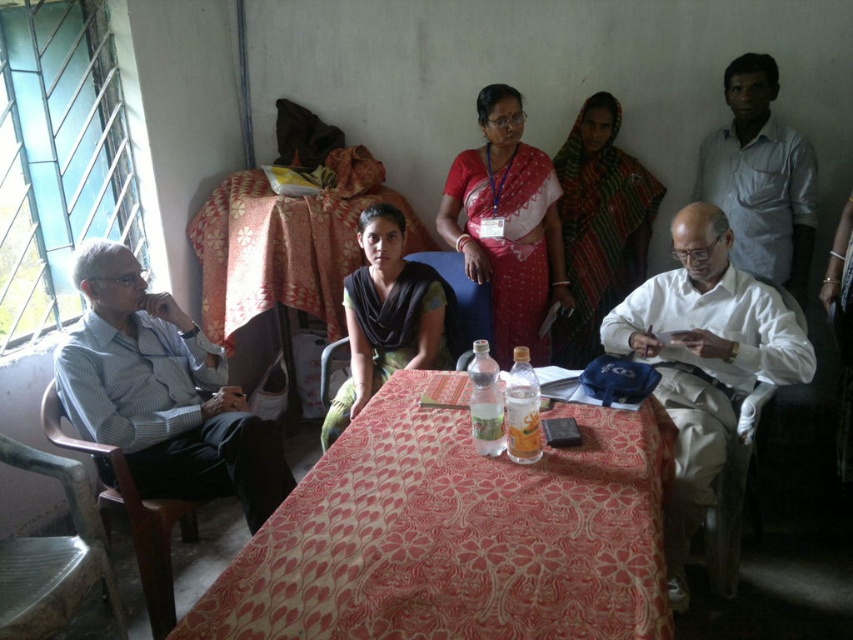
What do you see at coordinates (704, 360) in the screenshot? The height and width of the screenshot is (640, 853). I see `white cotton shirt at right` at bounding box center [704, 360].

Can you confirm if white cotton shirt at right is positioned to the right of white cotton shirt at upper right?

Incorrect, white cotton shirt at right is not on the right side of white cotton shirt at upper right.

Measure the distance between point (683, 337) and camera.

Point (683, 337) and camera are 2.13 meters apart.

Identify the location of white cotton shirt at right. Image resolution: width=853 pixels, height=640 pixels. (704, 360).

Is point (367, 566) behind point (595, 323)?

No, (367, 566) is in front of (595, 323).

Which is behind, point (459, 412) or point (589, 269)?

The point (589, 269) is behind.

This screenshot has height=640, width=853. What are the coordinates of `patterned fabric table at center` in the screenshot? It's located at (456, 532).

Does patterned fabric table at center come in front of floral fabric tablecloth at center?

Yes, patterned fabric table at center is in front of floral fabric tablecloth at center.

Which is below, patterned fabric table at center or floral fabric tablecloth at center?

Positioned lower is patterned fabric table at center.

What do you see at coordinates (456, 532) in the screenshot? I see `patterned fabric table at center` at bounding box center [456, 532].

You are a GUI agent. You are given a task and a screenshot of the screen. Output one action in this format:
    pyautogui.click(x=<x>, y=<y>)
    Task: Click on the patterned fabric table at center
    This screenshot has height=640, width=853.
    Given the screenshot: What is the action you would take?
    click(x=456, y=532)